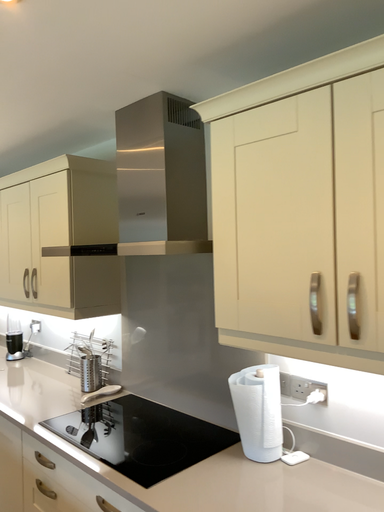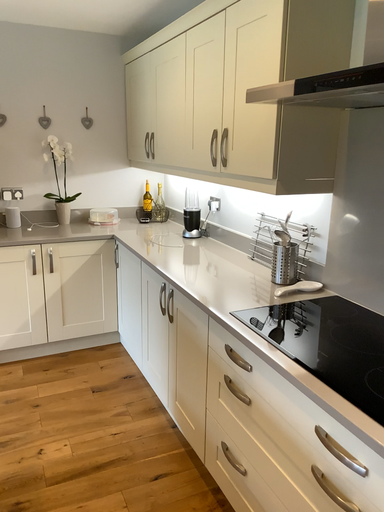
Question: Which way did the camera rotate in the video?

Choices:
 (A) rotated downward
 (B) rotated upward

Answer: (A)